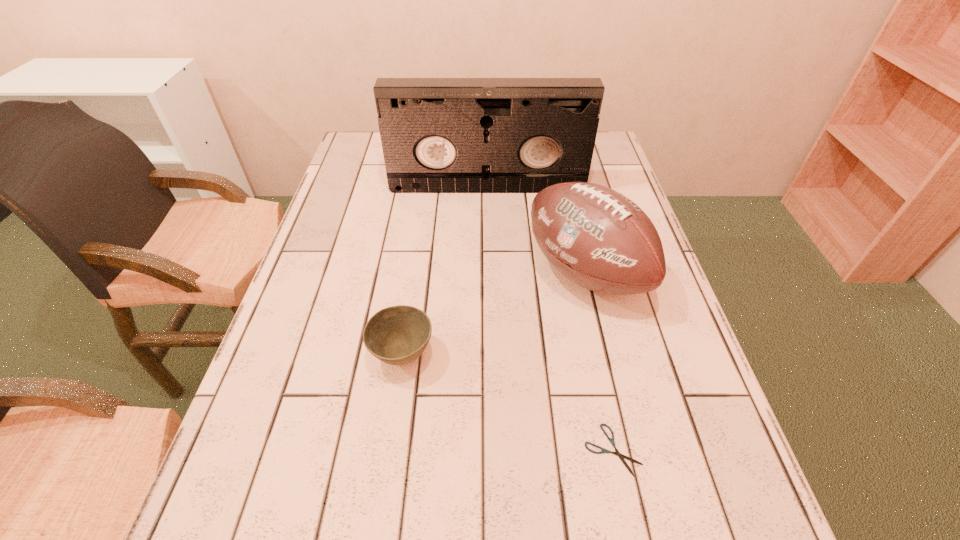
At what (x,y) coordinates should I click in order to perform the action: click on the farthest object. Please return your answer as a coordinate pair (x, y). Image resolution: width=960 pixels, height=540 pixels. Looking at the image, I should click on (439, 135).

I want to click on the tallest object, so click(439, 135).

Identify the location of the third shortest object. This screenshot has height=540, width=960. (598, 238).

What are the coordinates of `the second farthest object` in the screenshot? It's located at (598, 238).

Identify the location of bowl. The image size is (960, 540). (397, 335).

The width and height of the screenshot is (960, 540). What are the coordinates of `the second shortest object` in the screenshot? It's located at (397, 335).

Where is `the nearest object`? the nearest object is located at coordinates (621, 456).

Image resolution: width=960 pixels, height=540 pixels. I want to click on shears, so click(x=621, y=456).

Locate an element on the screen. This screenshot has width=960, height=540. blank space located 0.300m on the front side of the farthest object is located at coordinates (489, 266).

Identify the location of free spot located on the left of the football (American). (462, 273).